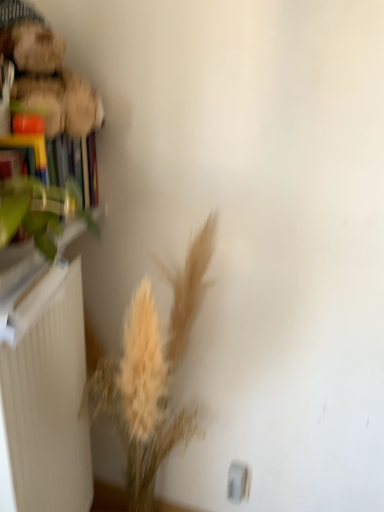
Question: Would you say white matte radiator at left is outside light beige dried grass at lower left?

Choices:
 (A) yes
 (B) no

Answer: (A)

Question: Is white matte radiator at left not close to light beige dried grass at lower left?

Choices:
 (A) no
 (B) yes

Answer: (A)

Question: From the image's perspective, does white matte radiator at left appear higher than light beige dried grass at lower left?

Choices:
 (A) no
 (B) yes

Answer: (A)

Question: Does white matte radiator at left come in front of light beige dried grass at lower left?

Choices:
 (A) no
 (B) yes

Answer: (A)

Question: Is white matte radiator at left looking in the opposite direction of light beige dried grass at lower left?

Choices:
 (A) no
 (B) yes

Answer: (B)

Question: Which is correct: hardcover book at left is inside white matte radiator at left, or outside of it?

Choices:
 (A) inside
 (B) outside

Answer: (B)

Question: Is hardcover book at left to the left or to the right of white matte radiator at left in the image?

Choices:
 (A) right
 (B) left

Answer: (A)

Question: In terms of width, does hardcover book at left look wider or thinner when compared to white matte radiator at left?

Choices:
 (A) wide
 (B) thin

Answer: (B)

Question: Is point (21, 145) closer or farther from the camera than point (39, 324)?

Choices:
 (A) closer
 (B) farther

Answer: (A)

Question: Is hardcover book at left taller or shorter than green leafy plant at left?

Choices:
 (A) tall
 (B) short

Answer: (A)

Question: Considering the positions of point (23, 142) and point (46, 205), is point (23, 142) closer or farther from the camera than point (46, 205)?

Choices:
 (A) closer
 (B) farther

Answer: (B)

Question: Do you think hardcover book at left is within green leafy plant at left, or outside of it?

Choices:
 (A) outside
 (B) inside

Answer: (A)

Question: From the image's perspective, is hardcover book at left located above or below green leafy plant at left?

Choices:
 (A) above
 (B) below

Answer: (A)

Question: From a real-world perspective, is light beige dried grass at lower left above or below white matte radiator at left?

Choices:
 (A) below
 (B) above

Answer: (B)

Question: Is light beige dried grass at lower left inside or outside of white matte radiator at left?

Choices:
 (A) inside
 (B) outside

Answer: (B)